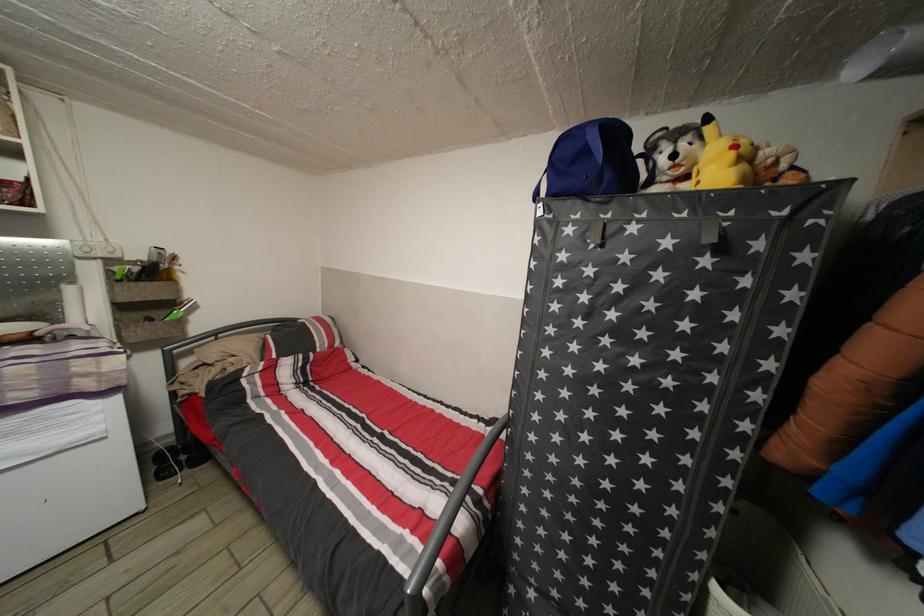
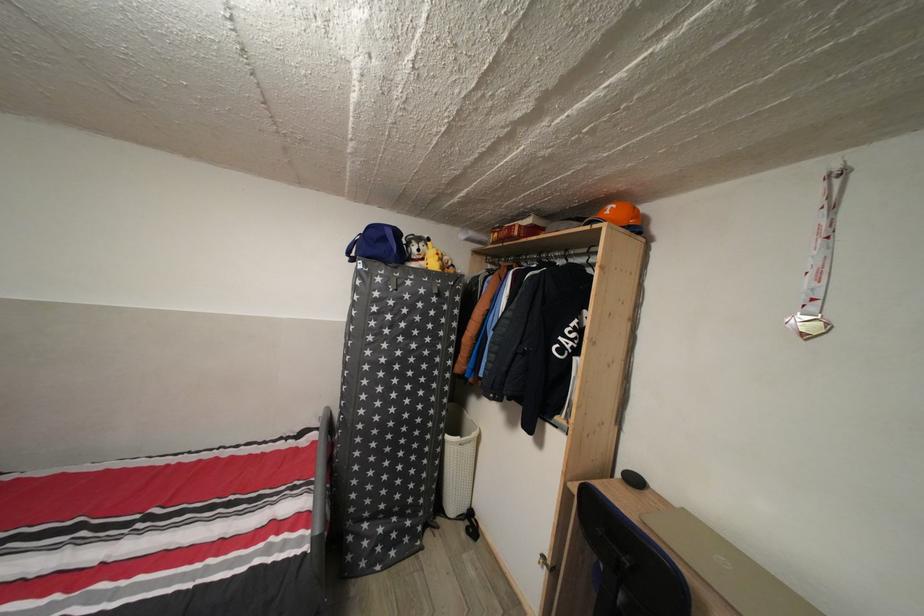
Question: Based on the continuous images, in which direction is the camera rotating? Reply with the corresponding letter.

Choices:
 (A) Left
 (B) Right
 (C) Up
 (D) Down

Answer: (B)